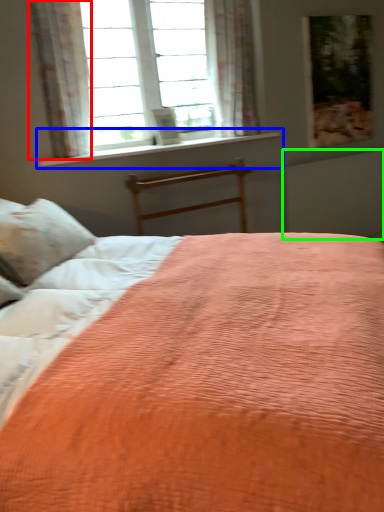
Question: Based on their relative distances, which object is farther from curtain (highlighted by a red box)? Choose from window sill (highlighted by a blue box) and radiator (highlighted by a green box).

Choices:
 (A) window sill
 (B) radiator

Answer: (B)